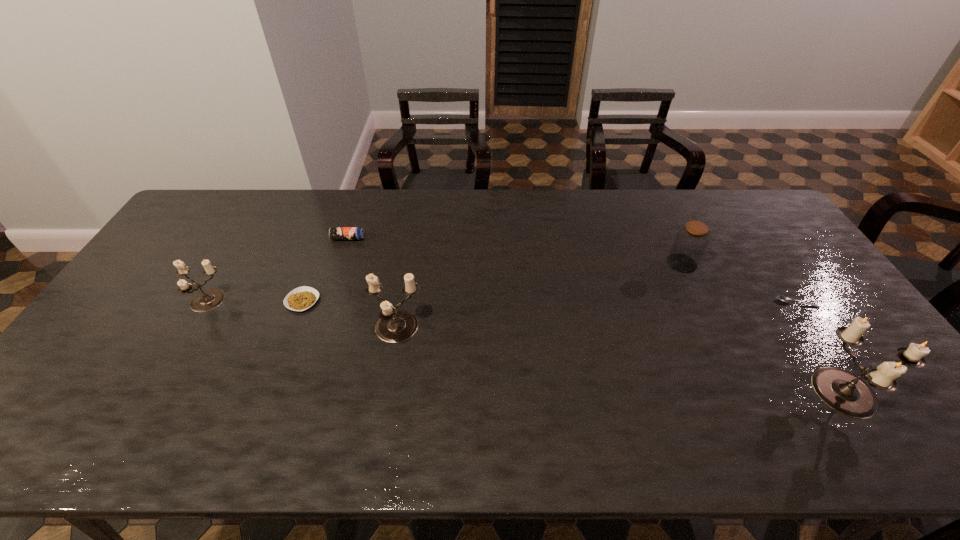
To make them evenly spaced by inserting another candle_holder among them, please locate a free space for this new candle_holder. Please provide its 2D coordinates. Your answer should be formatted as a tuple, i.e. [(x, y)], where the tuple contains the x and y coordinates of a point satisfying the conditions above.

[(609, 358)]